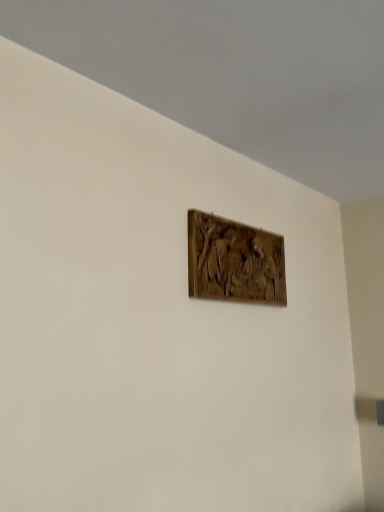
You are a GUI agent. You are given a task and a screenshot of the screen. Output one action in this format:
    pyautogui.click(x=<x>, y=<y>)
    Task: Click on the brown carved relief at upper center
    This screenshot has width=384, height=512.
    Given the screenshot: What is the action you would take?
    pyautogui.click(x=234, y=261)

The image size is (384, 512). What do you see at coordinates (234, 261) in the screenshot? I see `brown carved relief at upper center` at bounding box center [234, 261].

At what (x,y) coordinates should I click in order to perform the action: click on brown carved relief at upper center. Please return your answer as a coordinate pair (x, y). Looking at the image, I should click on (234, 261).